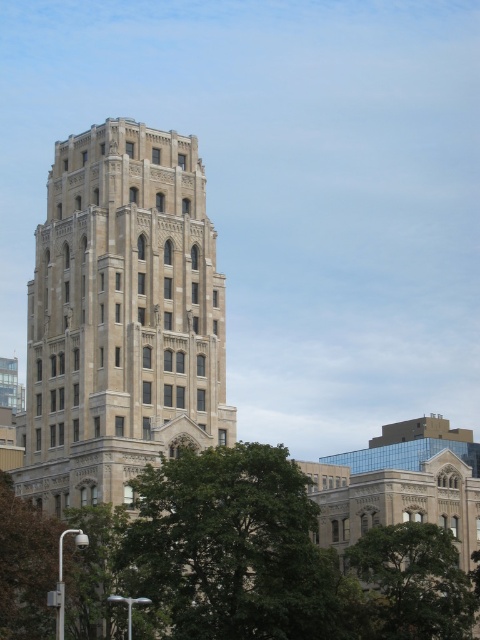
Question: From the image, what is the correct spatial relationship of green leafy tree at lower right in relation to green leafy tree at lower left?

Choices:
 (A) right
 (B) left

Answer: (A)

Question: Which is farther from the green leafy tree at lower right?

Choices:
 (A) green leafy tree at center
 (B) green leafy tree at lower left

Answer: (B)

Question: Is green leafy tree at lower right to the left of green leafy tree at lower left from the viewer's perspective?

Choices:
 (A) no
 (B) yes

Answer: (A)

Question: Which of the following is the farthest from the observer?

Choices:
 (A) green leafy tree at center
 (B) green leafy tree at lower left

Answer: (B)

Question: Which point is farther from the camera taking this photo?

Choices:
 (A) (409, 540)
 (B) (248, 614)
 (C) (8, 634)

Answer: (A)

Question: Can you confirm if green leafy tree at center is positioned to the left of green leafy tree at lower right?

Choices:
 (A) no
 (B) yes

Answer: (B)